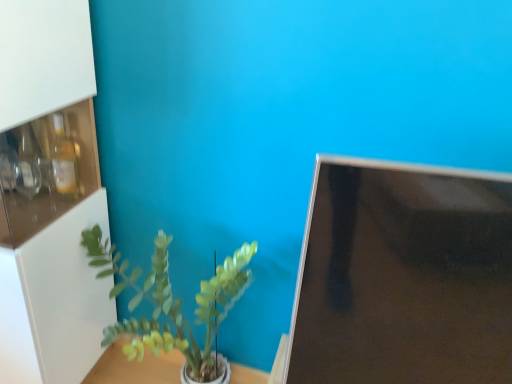
Image resolution: width=512 pixels, height=384 pixels. Identify the location of white glossy table at center. (135, 367).

Image resolution: width=512 pixels, height=384 pixels. Describe the element at coordinates (49, 195) in the screenshot. I see `white glossy cabinet at left` at that location.

The width and height of the screenshot is (512, 384). Find the location of `white glossy table at center`. white glossy table at center is located at coordinates (135, 367).

Is green matte plant at center shorter than white glossy cabinet at left?

Indeed, green matte plant at center has a lesser height compared to white glossy cabinet at left.

The height and width of the screenshot is (384, 512). I want to click on houseplant on the right of white glossy cabinet at left, so click(x=170, y=304).

From a real-world perspective, who is located higher, green matte plant at center or white glossy cabinet at left?

white glossy cabinet at left is physically above.

Is green matte plant at center spatially inside white glossy cabinet at left, or outside of it?

green matte plant at center is spatially situated outside white glossy cabinet at left.

Is white glossy cabinet at left taller or shorter than green matte plant at center?

Considering their sizes, white glossy cabinet at left has more height than green matte plant at center.

Is white glossy cabinet at left oriented towards green matte plant at center?

No, white glossy cabinet at left is not turned towards green matte plant at center.

Does point (47, 9) appear closer or farther from the camera than point (179, 317)?

Clearly, point (47, 9) is closer to the camera than point (179, 317).

Is white glossy table at center completely or partially outside of green matte plant at center?

white glossy table at center is positioned outside green matte plant at center.

Which is less distant, (x=130, y=379) or (x=157, y=247)?

The point (x=157, y=247) is more forward.

Would you say white glossy table at center is a long distance from green matte plant at center?

No, white glossy table at center is not far away from green matte plant at center.

Where is `table below the green matte plant at center (from a real-world perspective)`? The height and width of the screenshot is (384, 512). table below the green matte plant at center (from a real-world perspective) is located at coordinates (135, 367).

From a real-world perspective, relative to white glossy table at center, is white glossy cabinet at left vertically above or below?

In terms of real-world spatial position, white glossy cabinet at left is above white glossy table at center.

Find the location of a particular element. Image resolution: width=512 pixels, height=384 pixels. shelf in front of the white glossy table at center is located at coordinates (49, 195).

Is point (91, 144) closer to camera compared to point (165, 380)?

Yes, it is in front of point (165, 380).

Is white glossy cabinet at left located outside white glossy table at center?

white glossy cabinet at left is positioned outside white glossy table at center.

Does point (178, 313) lie behind point (439, 310)?

Yes, point (178, 313) is behind point (439, 310).

In order to click on houseplant beneath the black glossy monitor at right (from a real-world perspective) in this screenshot , I will do `click(170, 304)`.

Can you confirm if green matte plant at center is bigger than black glossy monitor at right?

Yes.

From a real-world perspective, between green matte plant at center and black glossy monitor at right, who is vertically lower?

green matte plant at center.

Considering the sizes of black glossy monitor at right and green matte plant at center in the image, is black glossy monitor at right bigger or smaller than green matte plant at center?

In the image, black glossy monitor at right appears to be smaller than green matte plant at center.

Considering the positions of point (403, 358) and point (212, 368), is point (403, 358) closer or farther from the camera than point (212, 368)?

Clearly, point (403, 358) is closer to the camera than point (212, 368).

From the image's perspective, which object appears higher, black glossy monitor at right or green matte plant at center?

black glossy monitor at right appears higher in the image.

Considering the relative positions of black glossy monitor at right and green matte plant at center in the image provided, is black glossy monitor at right to the left of green matte plant at center from the viewer's perspective?

No, black glossy monitor at right is not to the left of green matte plant at center.

Considering the positions of objects black glossy monitor at right and white glossy cabinet at left in the image provided, who is more to the left, black glossy monitor at right or white glossy cabinet at left?

white glossy cabinet at left.

Which of these two, black glossy monitor at right or white glossy cabinet at left, is smaller?

black glossy monitor at right.

Considering the positions of point (498, 319) and point (1, 77), is point (498, 319) closer or farther from the camera than point (1, 77)?

Point (498, 319) is positioned closer to the camera compared to point (1, 77).

From the image's perspective, does black glossy monitor at right appear higher than white glossy cabinet at left?

No.

Identify the location of shelf in front of the green matte plant at center. Image resolution: width=512 pixels, height=384 pixels. (49, 195).

Locate an element on the screen. The image size is (512, 384). shelf above the green matte plant at center (from a real-world perspective) is located at coordinates (49, 195).

Estimate the real-world distances between objects in this image. Which object is further from black glossy monitor at right, green matte plant at center or white glossy cabinet at left?

→ white glossy cabinet at left is further to black glossy monitor at right.

Which object lies further to the anchor point black glossy monitor at right, white glossy cabinet at left or white glossy table at center?

white glossy table at center is positioned further to the anchor black glossy monitor at right.

From the image, which object appears to be farther from green matte plant at center, white glossy cabinet at left or white glossy table at center?

white glossy table at center is further to green matte plant at center.

From the image, which object appears to be nearer to green matte plant at center, black glossy monitor at right or white glossy table at center?

Based on the image, white glossy table at center appears to be nearer to green matte plant at center.

Looking at the image, which one is located further to green matte plant at center, white glossy cabinet at left or black glossy monitor at right?

black glossy monitor at right.

When comparing their distances from green matte plant at center, does white glossy table at center or white glossy cabinet at left seem closer?

The object closer to green matte plant at center is white glossy cabinet at left.

When comparing their distances from white glossy table at center, does white glossy cabinet at left or green matte plant at center seem closer?

Based on the image, green matte plant at center appears to be nearer to white glossy table at center.

Based on their spatial positions, is black glossy monitor at right or white glossy cabinet at left closer to white glossy table at center?

white glossy cabinet at left is positioned closer to the anchor white glossy table at center.

Identify the location of houseplant positioned between white glossy cabinet at left and white glossy table at center from near to far. This screenshot has width=512, height=384. (170, 304).

Find the location of a particular element. houseplant between white glossy cabinet at left and black glossy monitor at right in the horizontal direction is located at coordinates (170, 304).

Image resolution: width=512 pixels, height=384 pixels. Find the location of `table situated between white glossy cabinet at left and black glossy monitor at right from left to right`. table situated between white glossy cabinet at left and black glossy monitor at right from left to right is located at coordinates (135, 367).

Where is `houseplant between black glossy monitor at right and white glossy table at center along the z-axis`? Image resolution: width=512 pixels, height=384 pixels. houseplant between black glossy monitor at right and white glossy table at center along the z-axis is located at coordinates (170, 304).